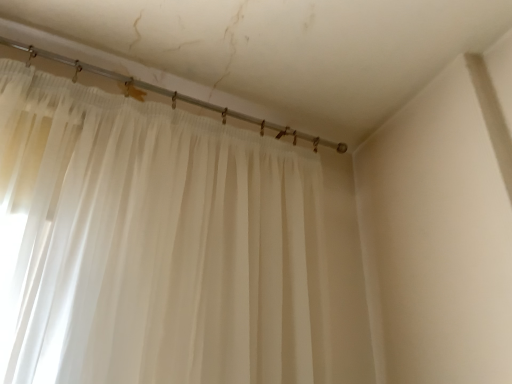
Question: From a real-world perspective, is translucent plastic curtain rod at upper center located higher than sheer white curtain at upper left?

Choices:
 (A) no
 (B) yes

Answer: (B)

Question: Is translucent plastic curtain rod at upper center surrounding sheer white curtain at upper left?

Choices:
 (A) yes
 (B) no

Answer: (B)

Question: Is translucent plastic curtain rod at upper center far from sheer white curtain at upper left?

Choices:
 (A) no
 (B) yes

Answer: (A)

Question: Is translucent plastic curtain rod at upper center at the right side of sheer white curtain at upper left?

Choices:
 (A) no
 (B) yes

Answer: (A)

Question: Considering the relative sizes of translucent plastic curtain rod at upper center and sheer white curtain at upper left in the image provided, is translucent plastic curtain rod at upper center taller than sheer white curtain at upper left?

Choices:
 (A) yes
 (B) no

Answer: (B)

Question: Can you see translucent plastic curtain rod at upper center touching sheer white curtain at upper left?

Choices:
 (A) no
 (B) yes

Answer: (A)

Question: Is the surface of sheer white curtain at upper left in direct contact with translucent plastic curtain rod at upper center?

Choices:
 (A) no
 (B) yes

Answer: (A)

Question: From a real-world perspective, does sheer white curtain at upper left stand above translucent plastic curtain rod at upper center?

Choices:
 (A) yes
 (B) no

Answer: (B)

Question: Is translucent plastic curtain rod at upper center inside sheer white curtain at upper left?

Choices:
 (A) yes
 (B) no

Answer: (B)

Question: Considering the relative positions of sheer white curtain at upper left and translucent plastic curtain rod at upper center in the image provided, is sheer white curtain at upper left to the right of translucent plastic curtain rod at upper center from the viewer's perspective?

Choices:
 (A) yes
 (B) no

Answer: (A)

Question: Could you tell me if sheer white curtain at upper left is turned towards translucent plastic curtain rod at upper center?

Choices:
 (A) yes
 (B) no

Answer: (B)

Question: Does sheer white curtain at upper left lie in front of translucent plastic curtain rod at upper center?

Choices:
 (A) yes
 (B) no

Answer: (A)

Question: Looking at their shapes, would you say sheer white curtain at upper left is wider or thinner than translucent plastic curtain rod at upper center?

Choices:
 (A) thin
 (B) wide

Answer: (B)